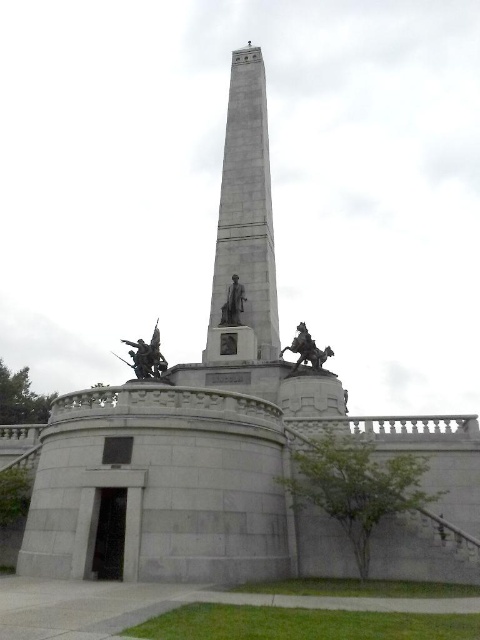
You are standing at the base of the monument and want to move from point A to point B. Point A is located at coordinates point (228, 154) and point B is at point (231, 314). Which direction should you move to reach point B from point A?

Since point (228, 154) is further to the viewer than point (231, 314), you should move forward towards the monument to reach point B from point A.

You are an art student analyzing the monument. You notice two sculptures on the circular platform. Which one has a greater width between the polished bronze horse at right and the polished bronze statue at center?

The polished bronze horse at right has a greater width than the polished bronze statue at center.

You are a visitor standing at the base of the monument. You want to take a photo of both the gray stone obelisk at center and the polished bronze horse at right in the same frame. Which object should you position closer to the camera to ensure both are fully visible?

You should position the polished bronze horse at right closer to the camera because the gray stone obelisk at center is taller than the polished bronze horse at right. By placing the shorter object nearer, you can capture both in the frame without cropping either.